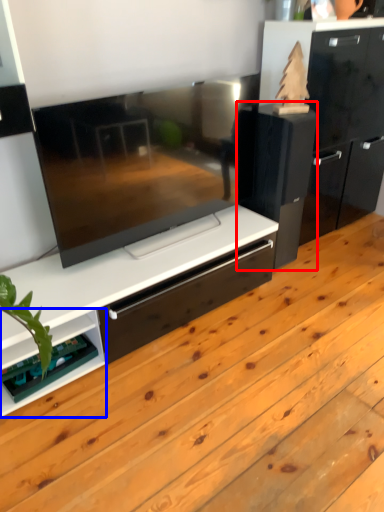
Question: Among these objects, which one is farthest to the camera, appliance (highlighted by a red box) or shelf (highlighted by a blue box)?

Choices:
 (A) appliance
 (B) shelf

Answer: (A)